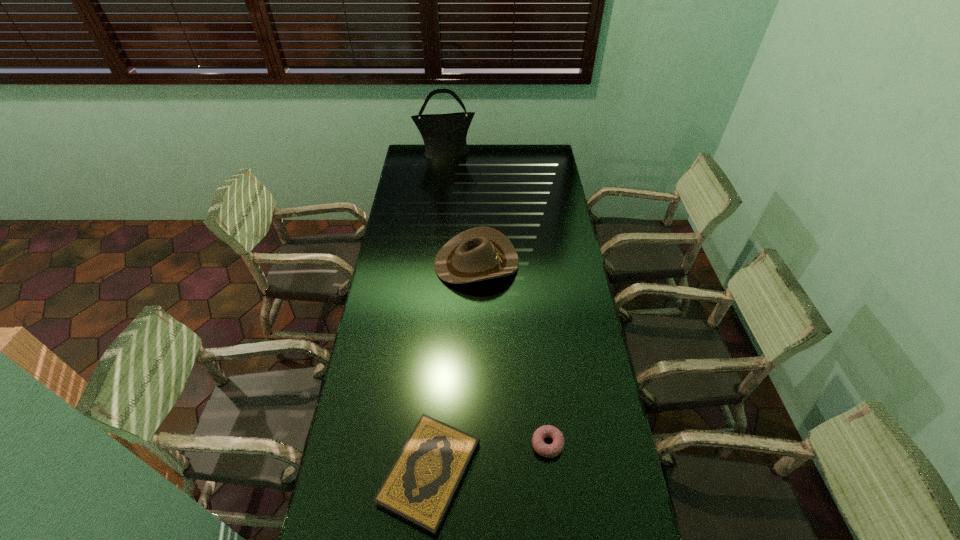
This screenshot has height=540, width=960. Identify the location of vacant space in between the tallest object and the hardback book. (438, 313).

Find the location of `free spot between the doughnut and the farthest object`. free spot between the doughnut and the farthest object is located at coordinates (496, 299).

Identify the location of vacant space that's between the cowboy hat and the tallest object. The width and height of the screenshot is (960, 540). (461, 208).

Locate an element on the screen. The height and width of the screenshot is (540, 960). vacant area that lies between the cowboy hat and the farthest object is located at coordinates (461, 208).

I want to click on free space between the cowboy hat and the farthest object, so click(x=461, y=208).

This screenshot has height=540, width=960. In order to click on free point between the doughnut and the cowboy hat in this screenshot , I will do `click(512, 354)`.

I want to click on free space between the doughnut and the farthest object, so click(496, 299).

In order to click on free spot between the third shortest object and the doughnut in this screenshot , I will do `click(512, 354)`.

Choose which object is the nearest neighbor to the farthest object. Please provide its 2D coordinates. Your answer should be formatted as a tuple, i.e. [(x, y)], where the tuple contains the x and y coordinates of a point satisfying the conditions above.

[(480, 253)]

Point out which object is positioned as the second nearest to the third nearest object. Please provide its 2D coordinates. Your answer should be formatted as a tuple, i.e. [(x, y)], where the tuple contains the x and y coordinates of a point satisfying the conditions above.

[(552, 450)]